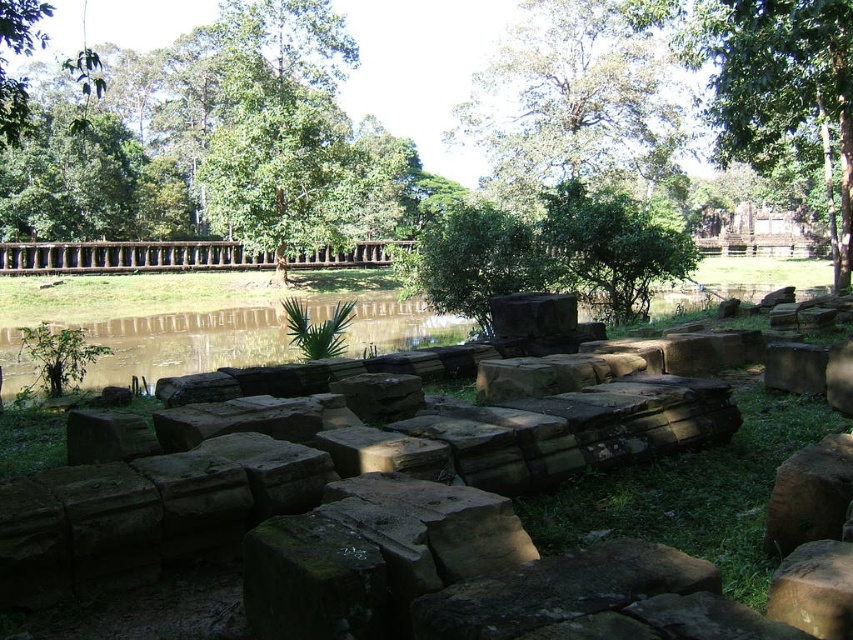
Question: Which object appears closest to the camera in this image?

Choices:
 (A) brown/earthy water at center
 (B) green leafy tree at upper right

Answer: (A)

Question: Is green leafy tree at upper center positioned behind green leafy tree at upper right?

Choices:
 (A) yes
 (B) no

Answer: (A)

Question: Which of these objects is positioned closest to the green leafy tree at upper center?

Choices:
 (A) green leafy tree at upper right
 (B) brown/earthy water at center

Answer: (A)

Question: Which object appears farthest from the camera in this image?

Choices:
 (A) green leafy tree at upper right
 (B) green leafy tree at upper center

Answer: (B)

Question: Is green leafy tree at upper center wider than green leafy tree at upper right?

Choices:
 (A) yes
 (B) no

Answer: (A)

Question: Does green leafy tree at upper right lie in front of brown/earthy water at center?

Choices:
 (A) no
 (B) yes

Answer: (A)